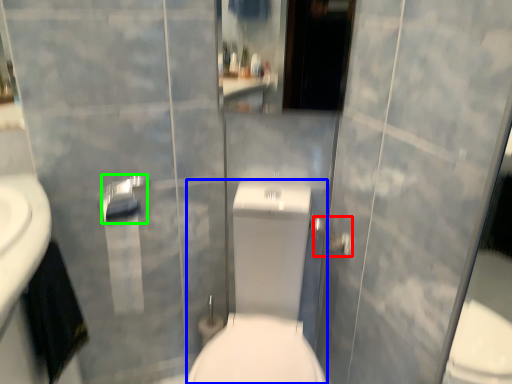
Question: Based on their relative distances, which object is nearer to shower (highlighted by a red box)? Choose from sit (highlighted by a blue box) and towel bar (highlighted by a green box).

Choices:
 (A) sit
 (B) towel bar

Answer: (A)